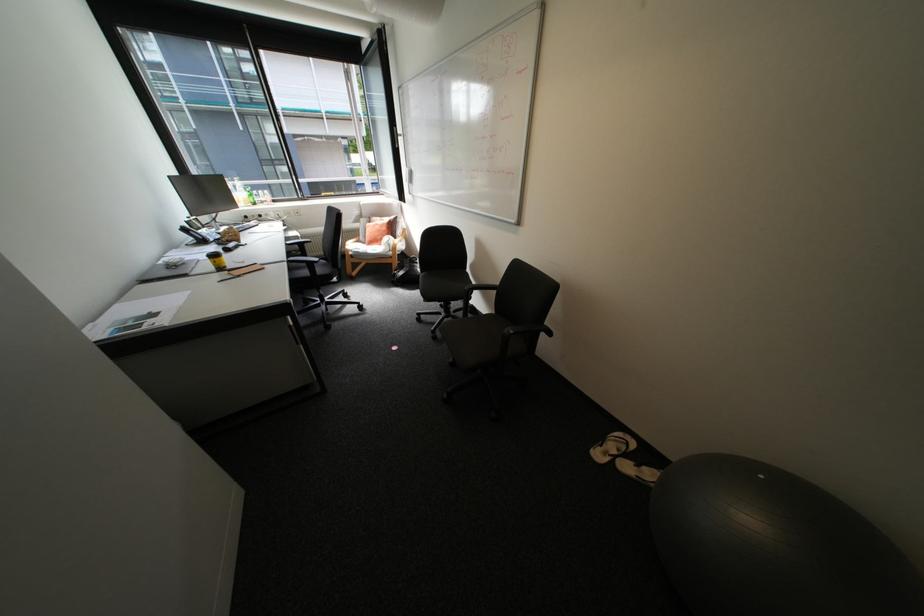
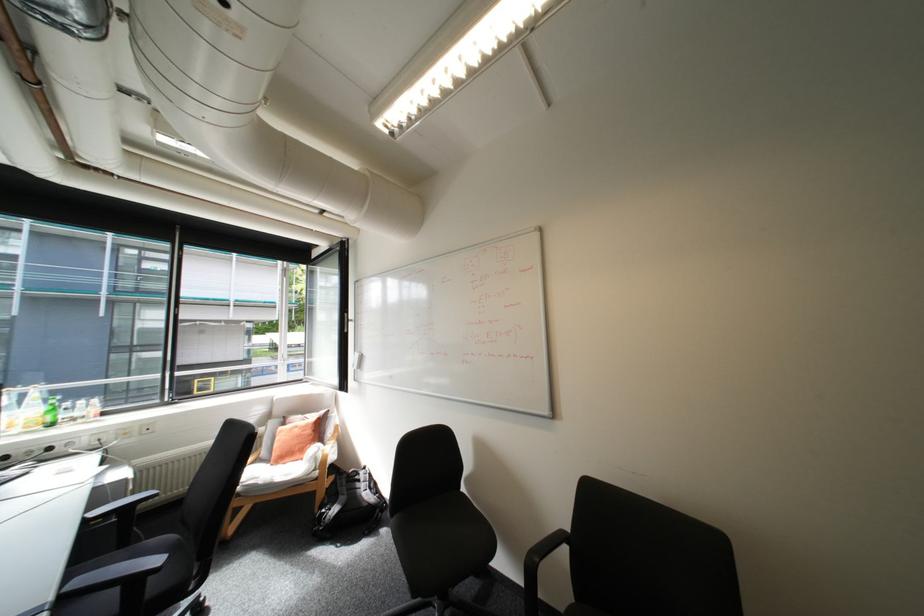
Where in the second image is the point corresponding to point (408, 272) from the first image?

(339, 509)